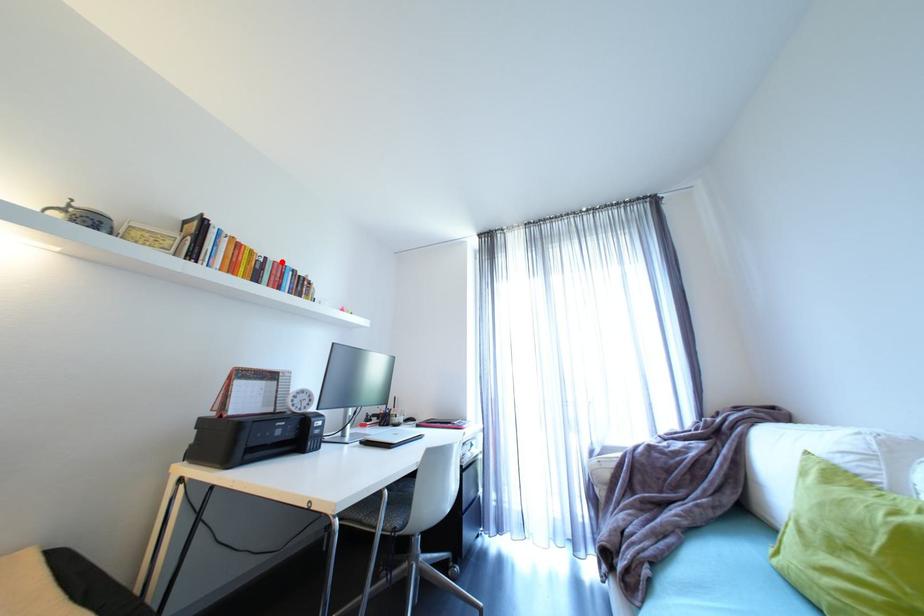
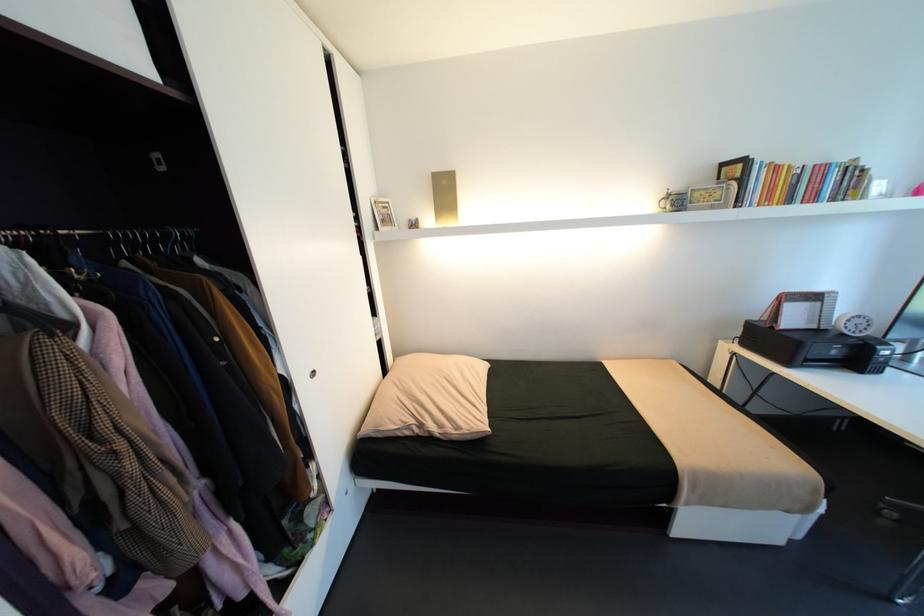
The point at the highlighted location is marked in the first image. Where is the corresponding point in the second image?

(821, 166)